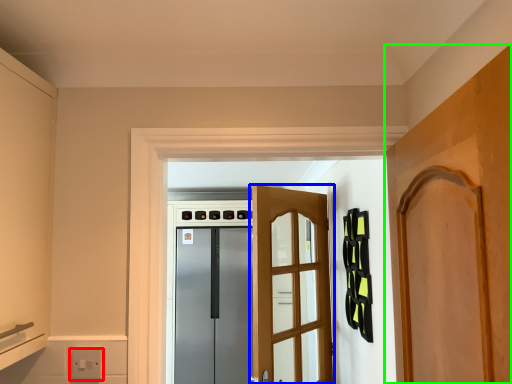
Question: Which is farther away from electric outlet (highlighted by a red box)? door (highlighted by a blue box) or door (highlighted by a green box)?

Choices:
 (A) door
 (B) door

Answer: (A)